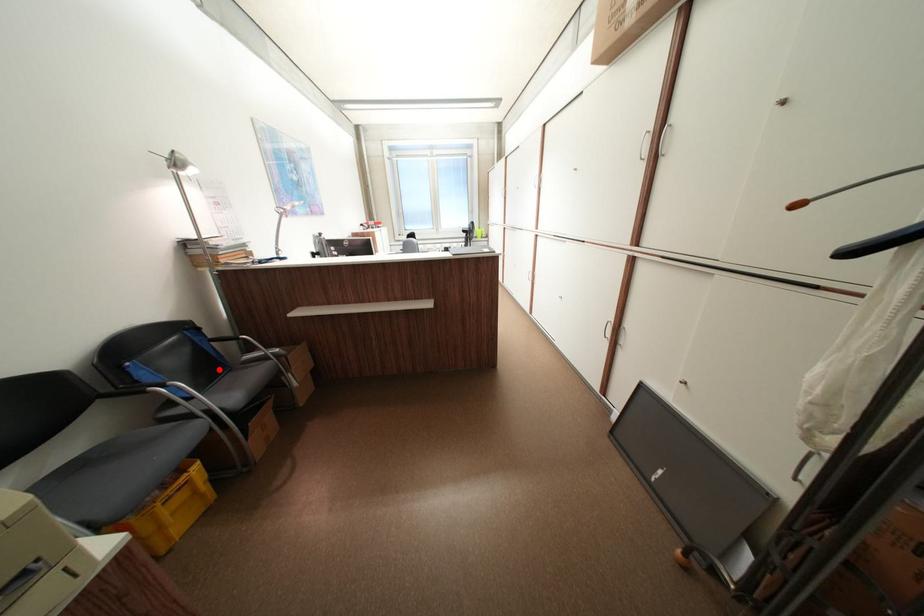
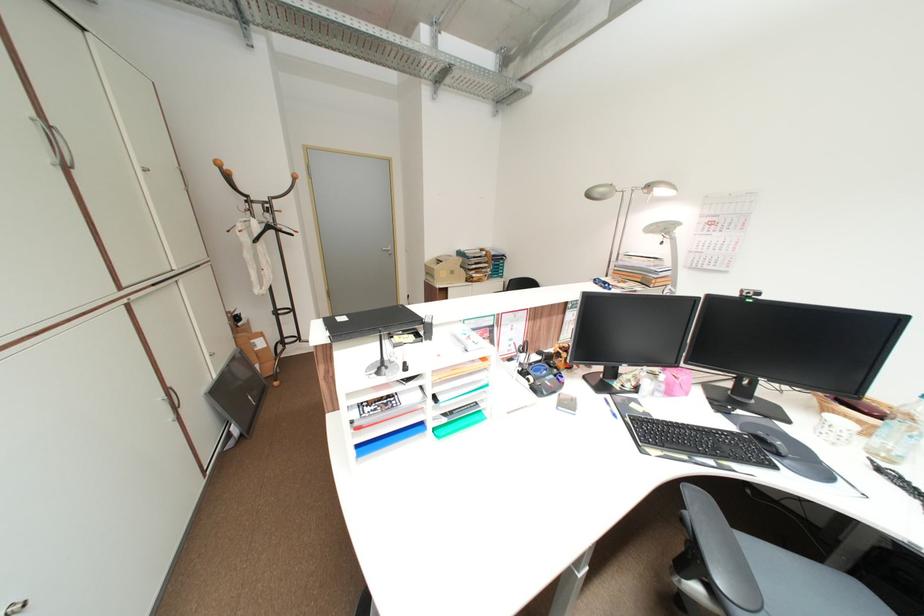
Question: I am providing you with two images of the same scene from different viewpoints. A red point is marked on the first image. Is the red point's position out of view in image 2?

Choices:
 (A) Yes
 (B) No

Answer: (A)